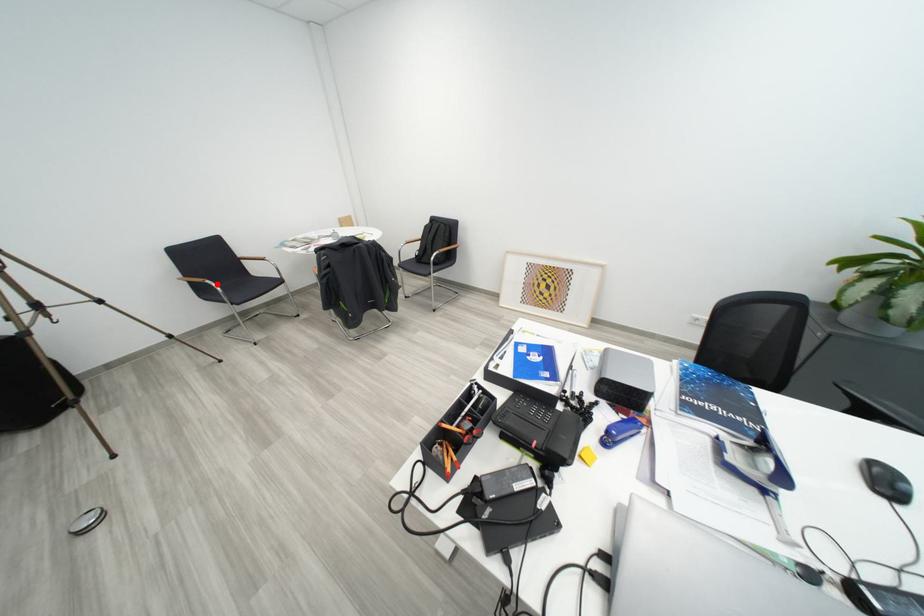
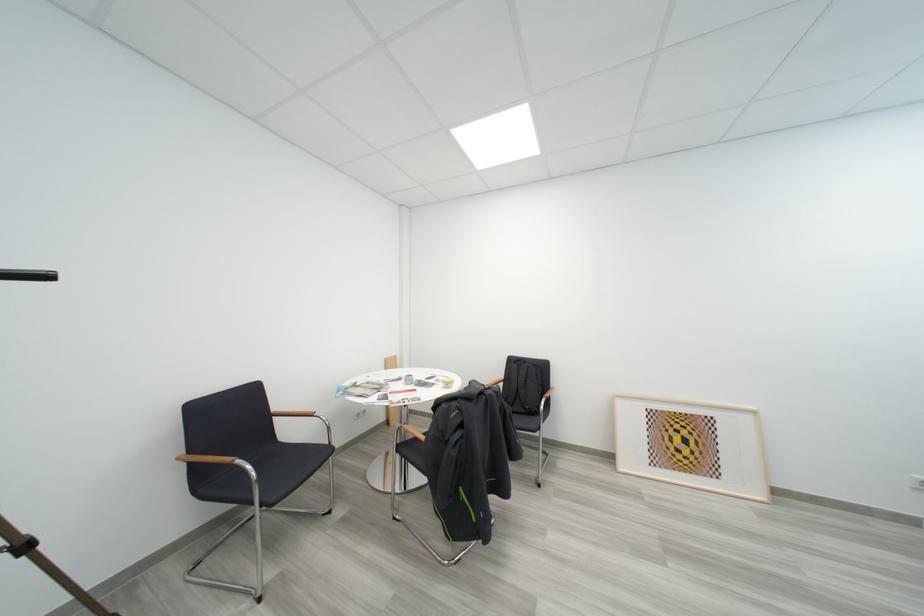
Question: I am providing you with two images of the same scene from different viewpoints. Image1 has a red point marked. In image2, the corresponding 3D location appears at what relative position? Reply with the corresponding letter.

Choices:
 (A) Closer
 (B) Farther

Answer: (B)